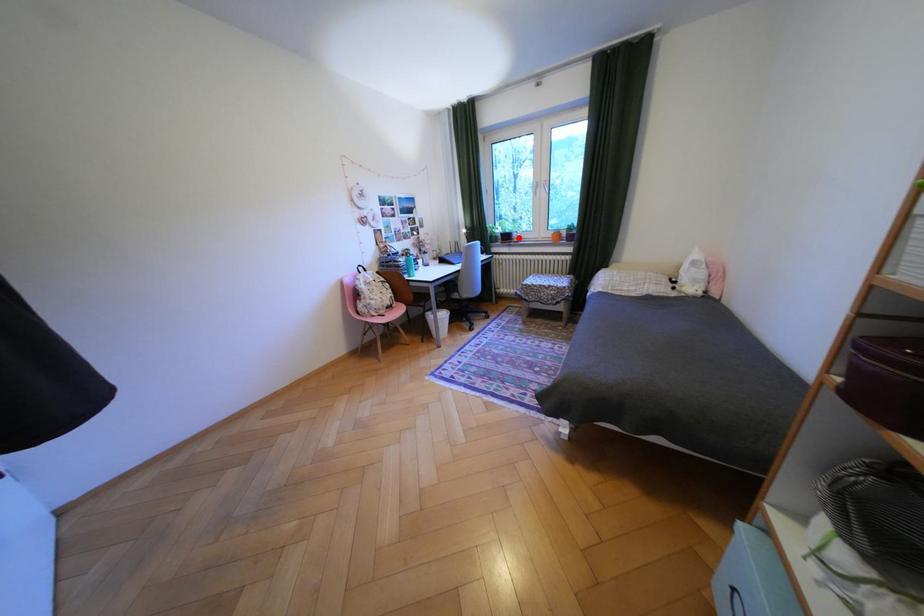
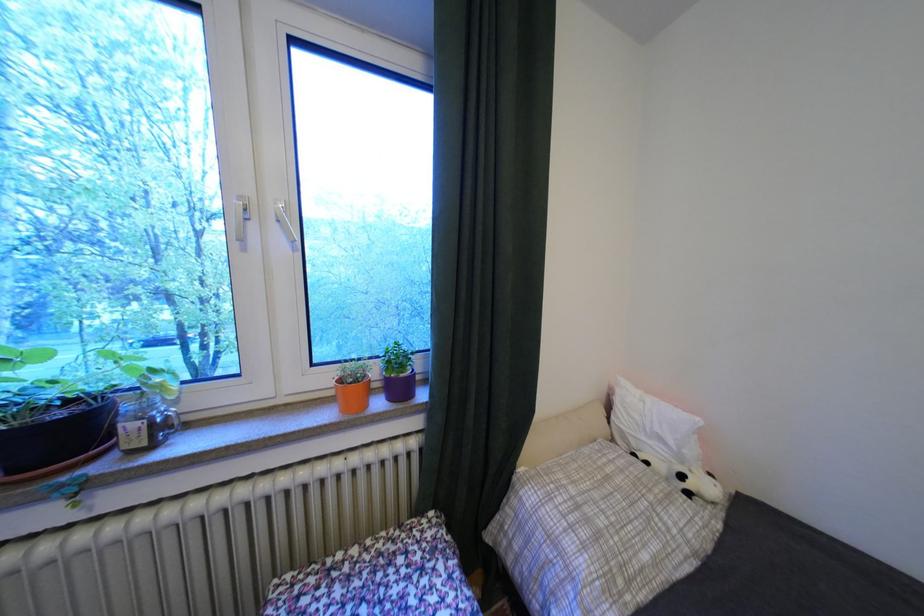
Find the pixel in the second image that matches the highlighted location in the first image.

(75, 436)